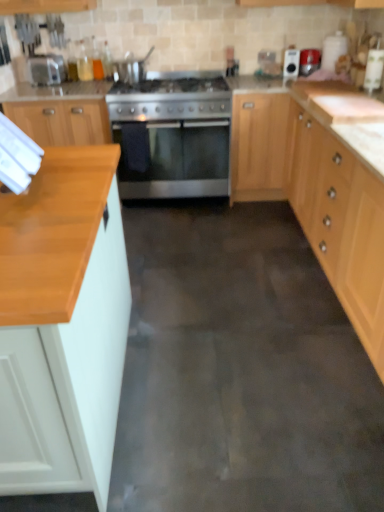
Question: In the image, is satin silver pot at upper center, which is counted as the 3th appliance, starting from the right, on the left side or the right side of metallic red toaster at upper right, the first appliance from the right?

Choices:
 (A) left
 (B) right

Answer: (A)

Question: Is satin silver pot at upper center, which is counted as the 3th appliance, starting from the right, taller or shorter than metallic red toaster at upper right, positioned as the 3th appliance in left-to-right order?

Choices:
 (A) tall
 (B) short

Answer: (A)

Question: Based on their relative distances, which object is nearer to the metallic red toaster at upper right, positioned as the 3th appliance in left-to-right order?

Choices:
 (A) satin silver pot at upper center, placed as the first appliance when sorted from left to right
 (B) metallic silver toaster at upper right, placed as the second appliance when sorted from right to left
 (C) stainless steel gas stove at center
 (D) wooden cabinet at center, the 2th cabinetry when ordered from front to back
 (E) wooden countertop at left, placed as the 1th cabinetry when sorted from bottom to top

Answer: (B)

Question: Considering the real-world distances, which object is farthest from the wooden countertop at left, which is counted as the second cabinetry, starting from the right?

Choices:
 (A) satin silver pot at upper center, placed as the first appliance when sorted from left to right
 (B) wooden cabinet at center, which is counted as the second cabinetry, starting from the bottom
 (C) stainless steel oven at center
 (D) metallic silver toaster at upper right, placed as the second appliance when sorted from right to left
 (E) satin silver toaster at upper left

Answer: (D)